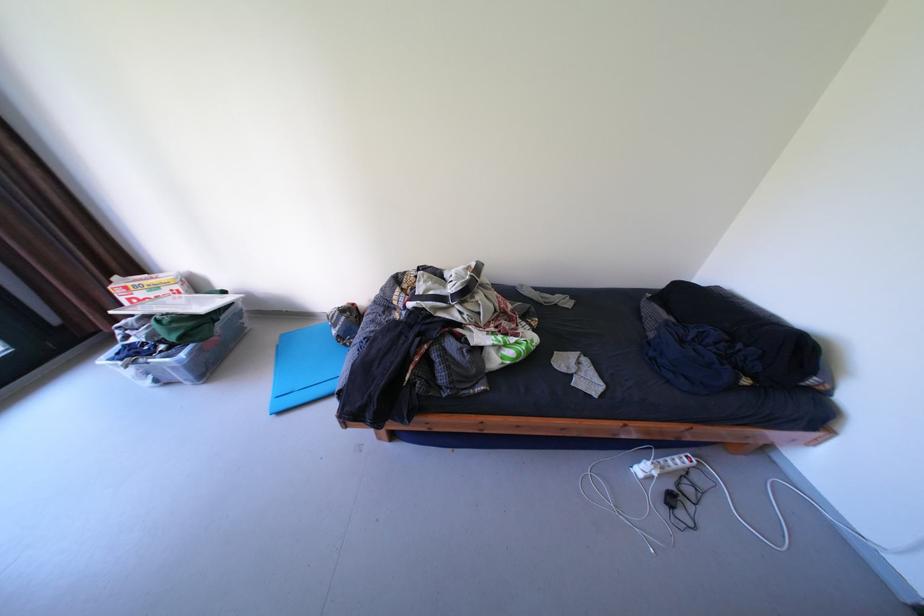
Find where to lift the laundry detergent box. Please return your answer as a coordinate pair (x, y).

(147, 290)